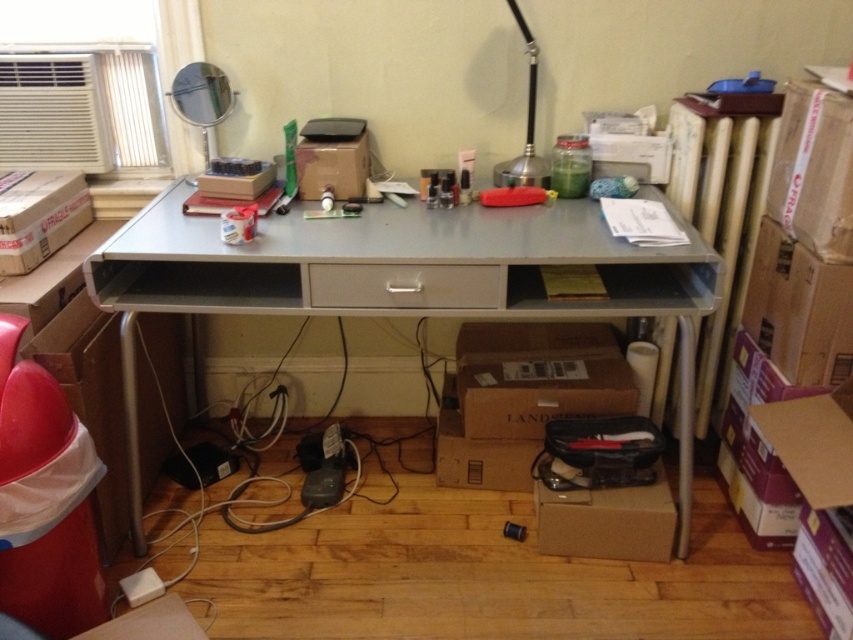
You are organizing your desk and want to place the cardboard box at lower center and the cardboard box at left into a drawer. The drawer can only fit items that are smaller than 15 inches in height. Which box should you choose?

The cardboard box at lower center is smaller than the cardboard box at left, so it is more likely to fit in the drawer if the drawer can only accommodate items smaller than 15 inches in height.

You are organizing your desk and need to place a new item that requires a space wider than 30 cm. You have two cardboard boxes available. Which one between the cardboard box at lower center and the cardboard box at left should you choose?

The cardboard box at lower center has a larger width than the cardboard box at left, so you should choose the cardboard box at lower center since it can accommodate items requiring more than 30 cm of space.

You are organizing items on the desk and need to place a new item between the cardboard box at lower center and the cardboard box at left. Based on their positions, which box should you place the new item closer to?

You should place the new item closer to the cardboard box at left because the cardboard box at lower center is to the right of the cardboard box at left, so the left box is on the left side and the lower center box is on the right side of the pair.